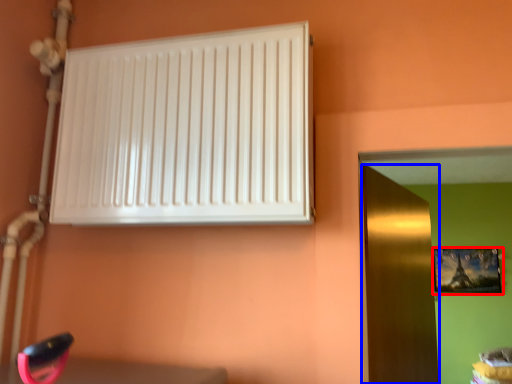
Question: Which of the following is the closest to the observer, picture frame (highlighted by a red box) or door (highlighted by a blue box)?

Choices:
 (A) picture frame
 (B) door

Answer: (B)